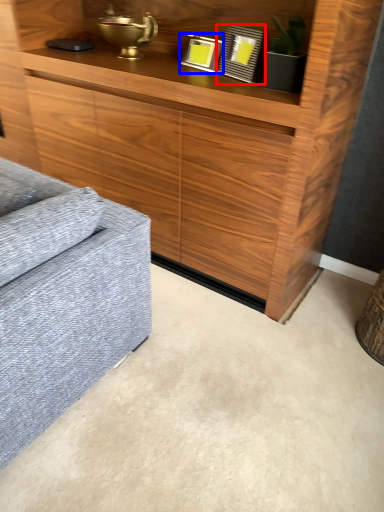
Question: Among these objects, which one is nearest to the camera, picture frame (highlighted by a red box) or picture frame (highlighted by a blue box)?

Choices:
 (A) picture frame
 (B) picture frame

Answer: (A)